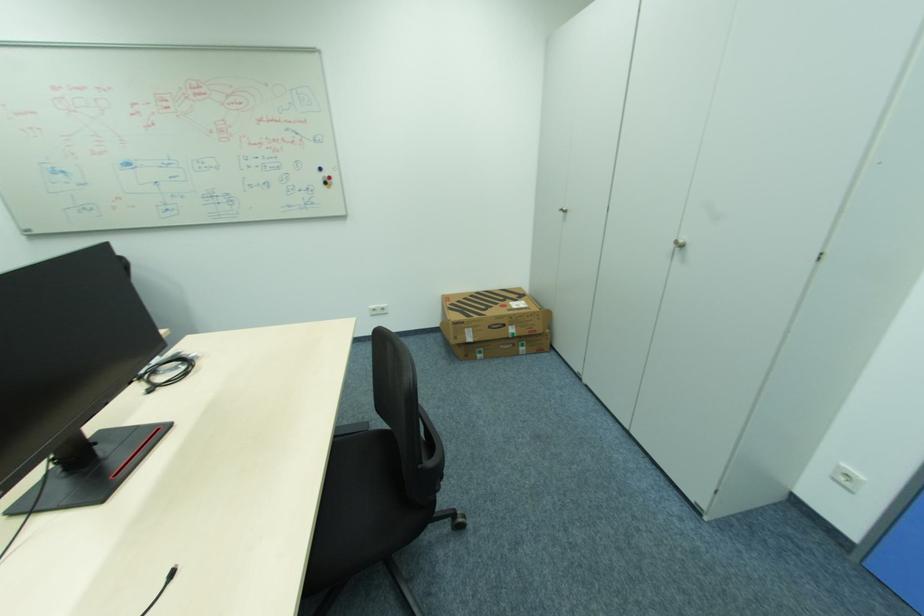
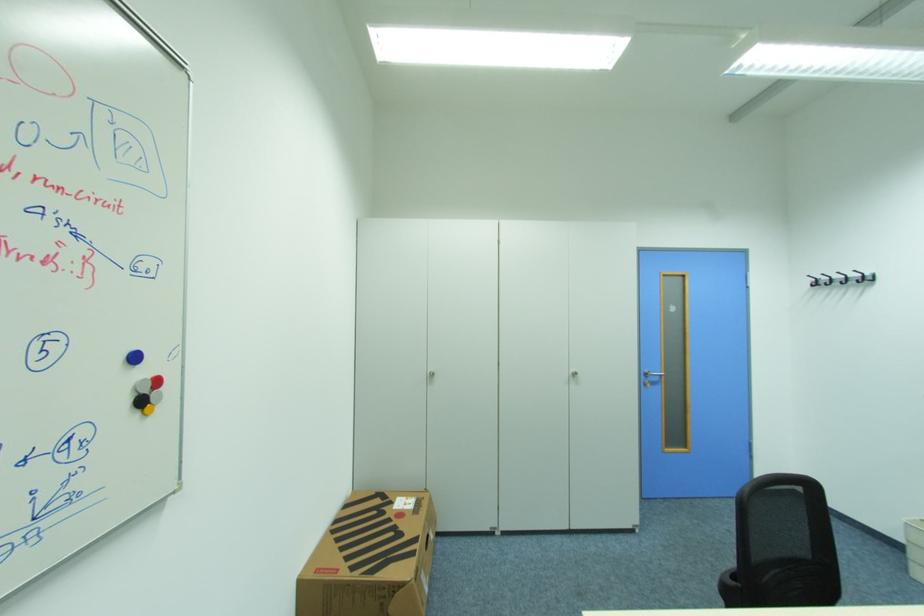
Locate, in the second image, the point that corresponds to [334,177] in the first image.

(162, 382)